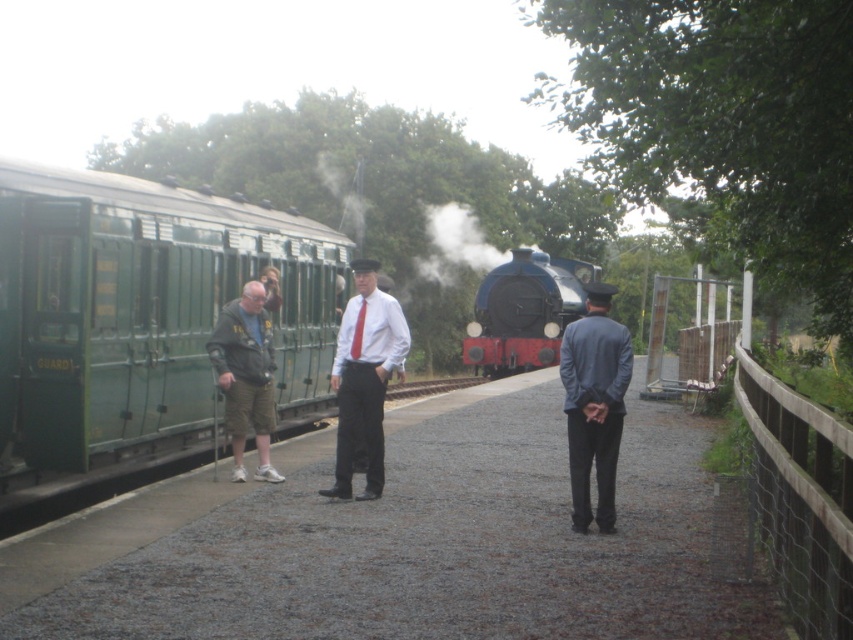
Question: Does green painted metal train car at left appear over matte white shirt at center?

Choices:
 (A) yes
 (B) no

Answer: (A)

Question: Can you confirm if dark green jacket at left is positioned above white smoke at center?

Choices:
 (A) no
 (B) yes

Answer: (A)

Question: Which object is farther from the camera taking this photo?

Choices:
 (A) shiny blue locomotive at center
 (B) matte white shirt at center

Answer: (A)

Question: Which of these objects is positioned farthest from the dark blue suit at center?

Choices:
 (A) matte white shirt at center
 (B) white smoke at center
 (C) shiny blue locomotive at center
 (D) dark green jacket at left

Answer: (B)

Question: Is dark blue suit at center positioned behind white smoke at center?

Choices:
 (A) no
 (B) yes

Answer: (A)

Question: Which object is closer to the camera taking this photo?

Choices:
 (A) white smoke at center
 (B) shiny blue locomotive at center
 (C) green painted metal train car at left

Answer: (C)